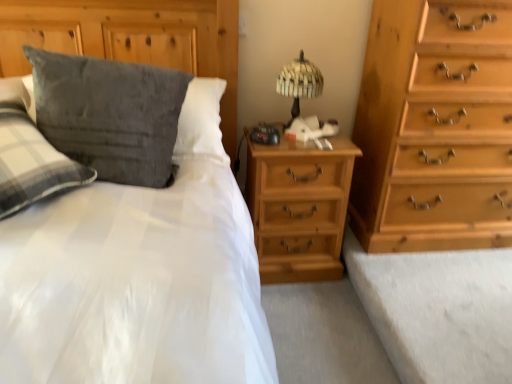
Question: Considering the relative positions of light brown wood nightstand at center and light brown wooden chest of drawers at right in the image provided, is light brown wood nightstand at center to the left or to the right of light brown wooden chest of drawers at right?

Choices:
 (A) left
 (B) right

Answer: (A)

Question: Is light brown wood nightstand at center spatially inside light brown wooden chest of drawers at right, or outside of it?

Choices:
 (A) outside
 (B) inside

Answer: (A)

Question: Considering the real-world distances, which object is farthest from the light brown wooden chest of drawers at right?

Choices:
 (A) suede-like gray pillow at upper left
 (B) woven wood table lamp at upper center
 (C) velvety gray pillow at upper left
 (D) light brown wood nightstand at center

Answer: (C)

Question: Which object is positioned farthest from the light brown wooden chest of drawers at right?

Choices:
 (A) velvety gray pillow at upper left
 (B) light brown wood nightstand at center
 (C) woven wood table lamp at upper center
 (D) suede-like gray pillow at upper left

Answer: (A)